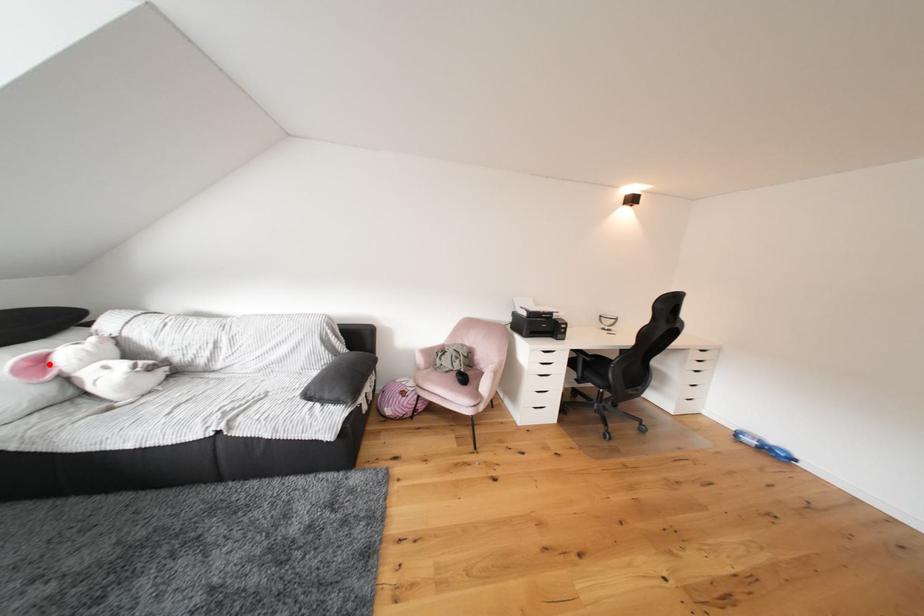
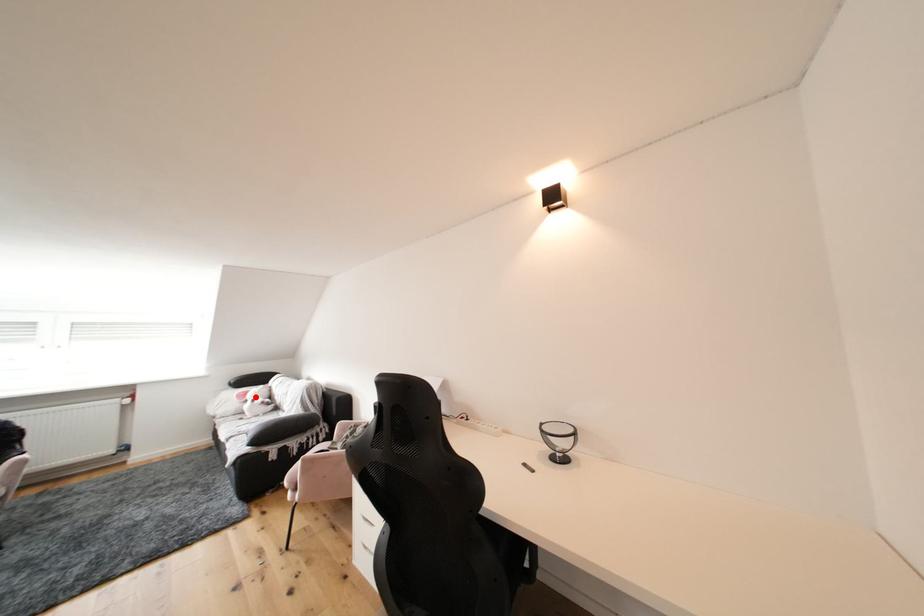
I am providing you with two images of the same scene from different viewpoints. A red point is marked on the first image and another point is marked on the second image. Is the marked point in image1 the same physical position as the marked point in image2?

Yes